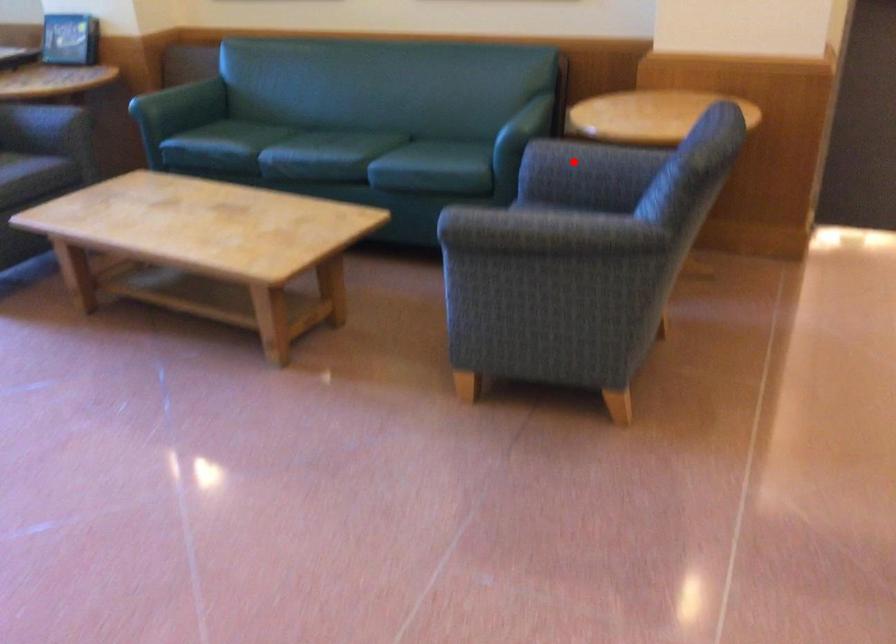
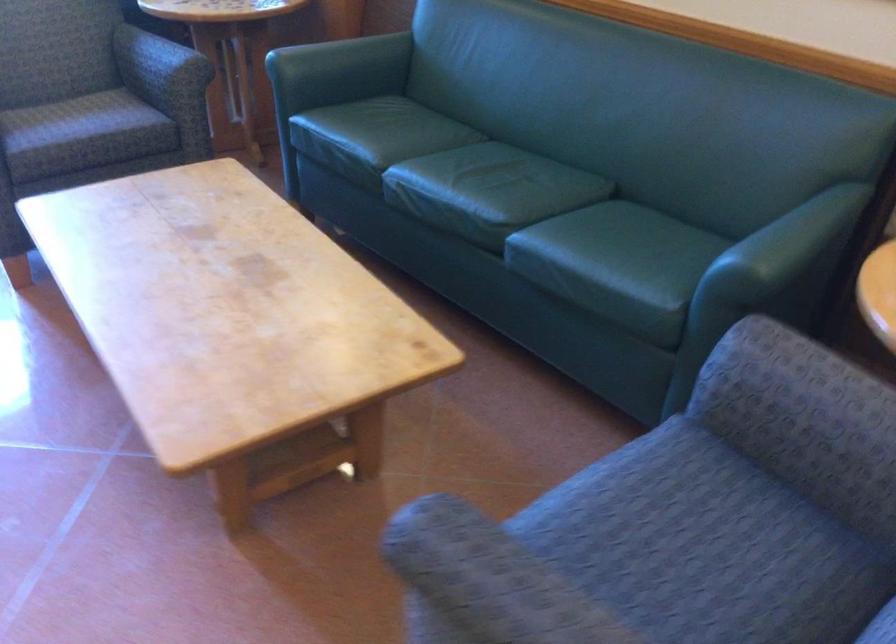
Find the pixel in the second image that matches the highlighted location in the first image.

(796, 404)